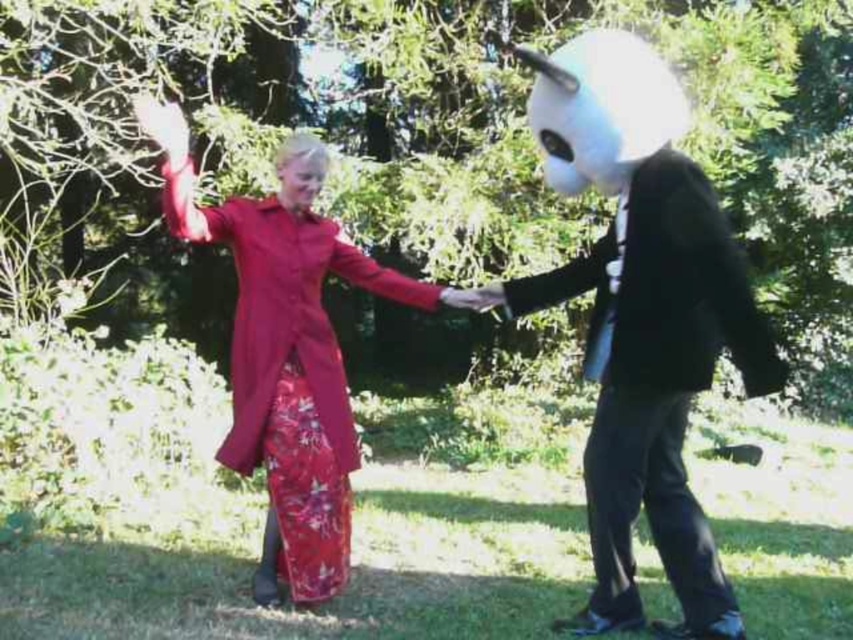
From the picture: Is matte black suit at center taller than matte red coat at center?

Correct, matte black suit at center is much taller as matte red coat at center.

Between point (183, 122) and point (308, 269), which one is positioned in front?

Point (183, 122)

Who is more forward, (604,401) or (328,552)?

Point (604,401) is more forward.

Find the location of a particular element. The height and width of the screenshot is (640, 853). matte black suit at center is located at coordinates (642, 317).

What are the coordinates of `matte black suit at center` in the screenshot? It's located at (642, 317).

Is point (599, 397) in front of point (671, 120)?

No, (599, 397) is further to viewer.

Locate an element on the screen. matte black suit at center is located at coordinates (642, 317).

Is white matte mask at right below matte red coat at center?

Yes.

Which of these two, white matte mask at right or matte red coat at center, stands shorter?

matte red coat at center is shorter.

Image resolution: width=853 pixels, height=640 pixels. In order to click on white matte mask at right in this screenshot , I will do `click(643, 320)`.

Where is `white matte mask at right`? The image size is (853, 640). white matte mask at right is located at coordinates (643, 320).